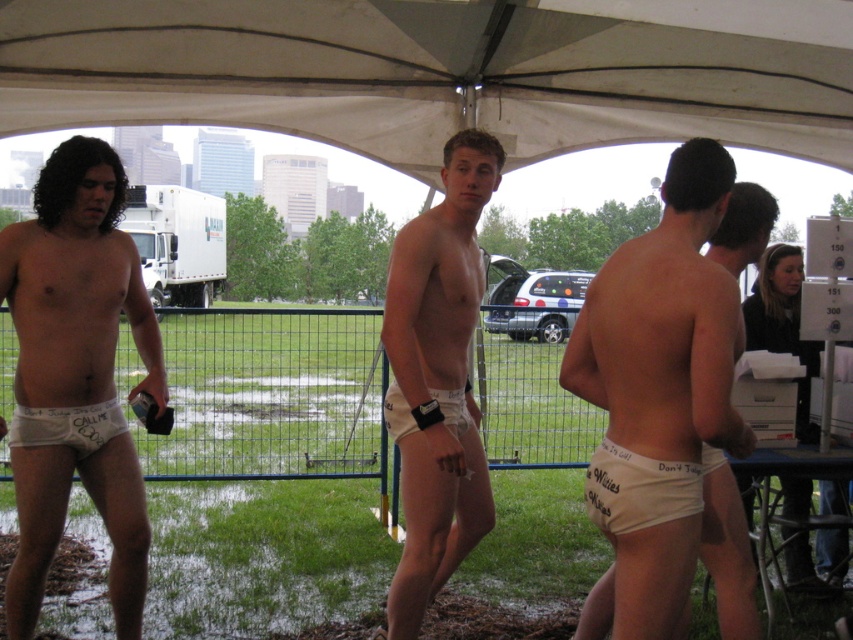
You are a photographer taking a picture of the scene. You want to ensure both the white cotton underwear at lower right and the white cotton underwear at left are visible in the frame. Based on their positions, which underwear should you focus on first to capture both in the shot?

The white cotton underwear at lower right is to the right of the white cotton underwear at left. To capture both in the frame, focus on the white cotton underwear at left first, as it is positioned to the left, and then adjust the shot to include the one on the right.

You are a photographer trying to capture both the white cotton underwear at lower right and the white cotton underwear at left in a single frame. Which underwear should you focus on first to ensure both are in the frame?

The white cotton underwear at lower right is larger in size compared to the white cotton underwear at left, so you should focus on the white cotton underwear at lower right first to ensure both are in the frame.